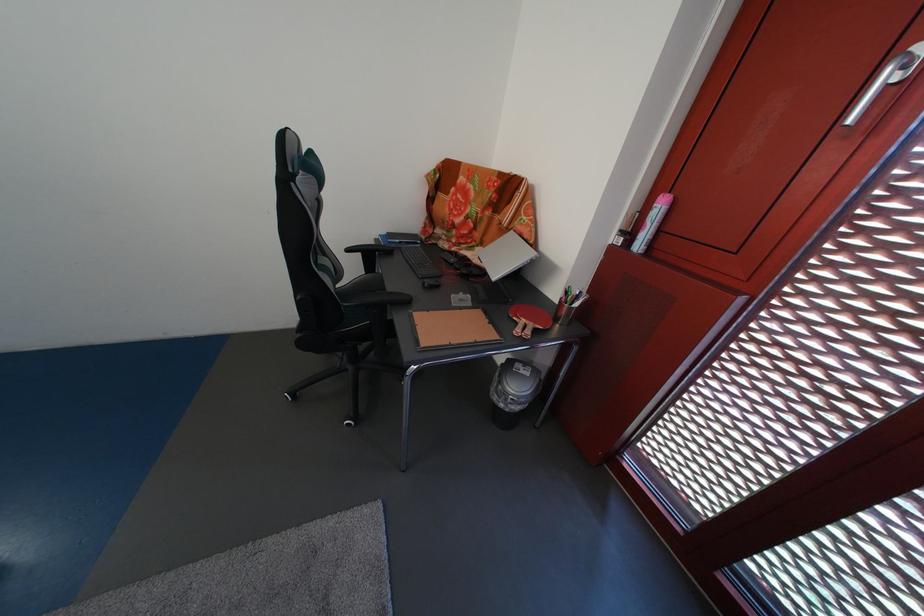
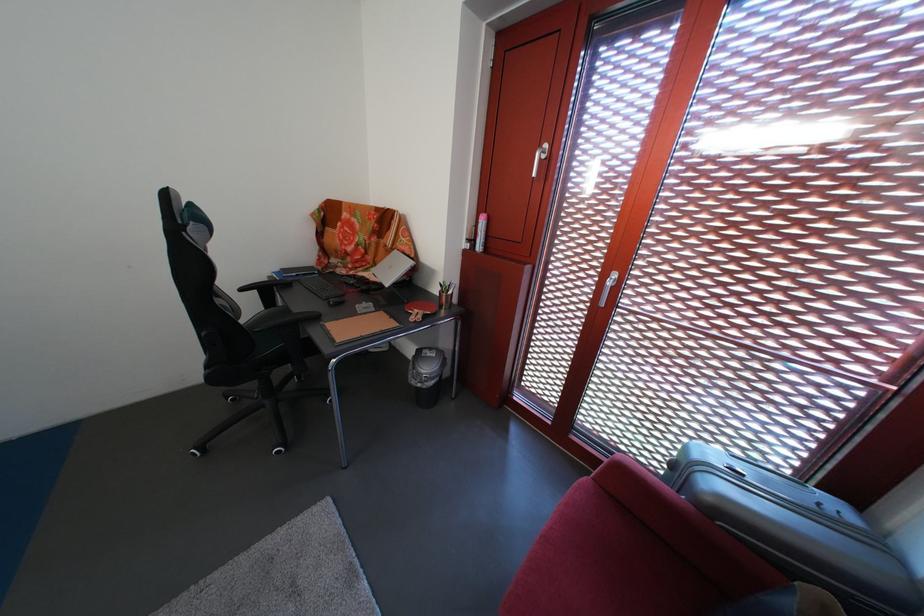
Where in the second image is the point corresponding to (x=633, y=238) from the first image?

(479, 246)